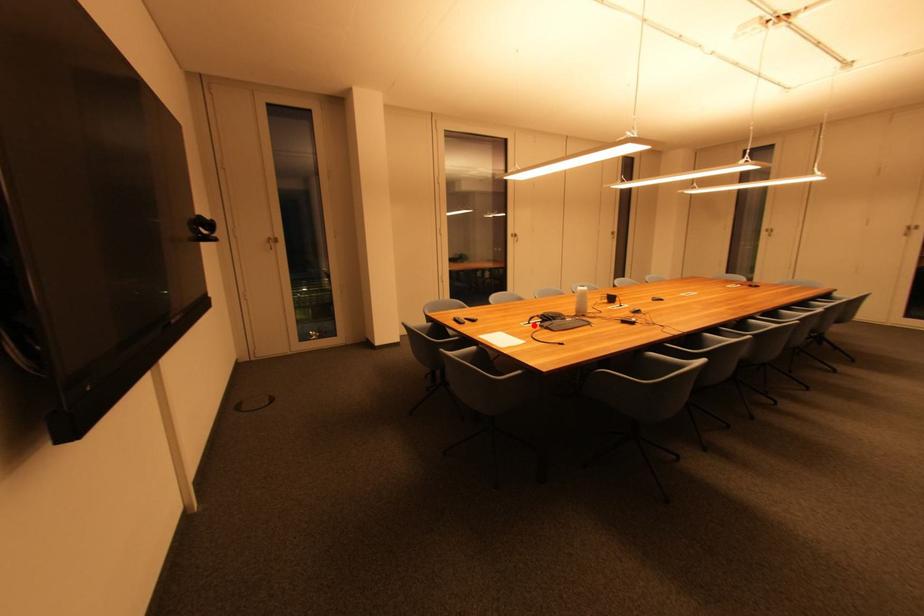
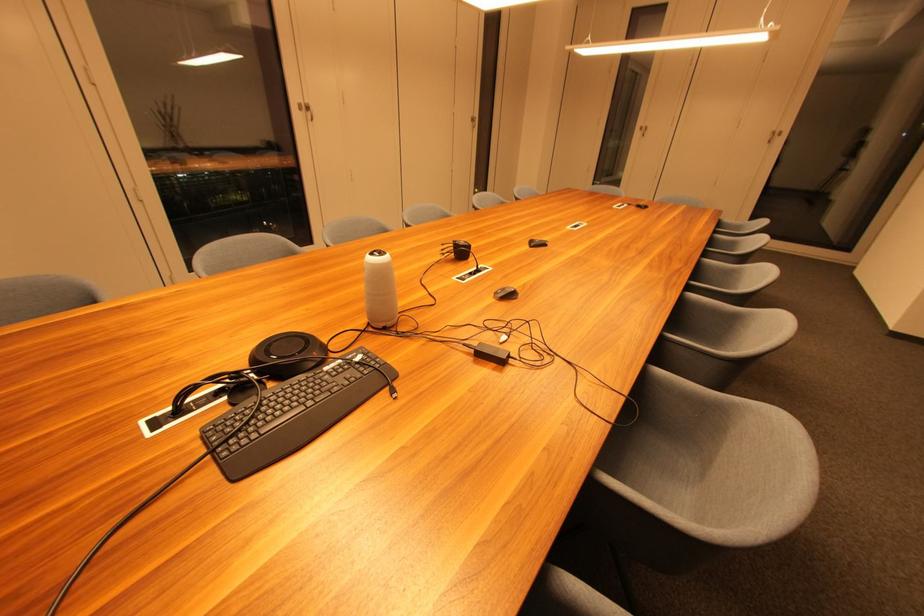
Find the pixel in the second image that matches the highlighted location in the first image.

(185, 414)